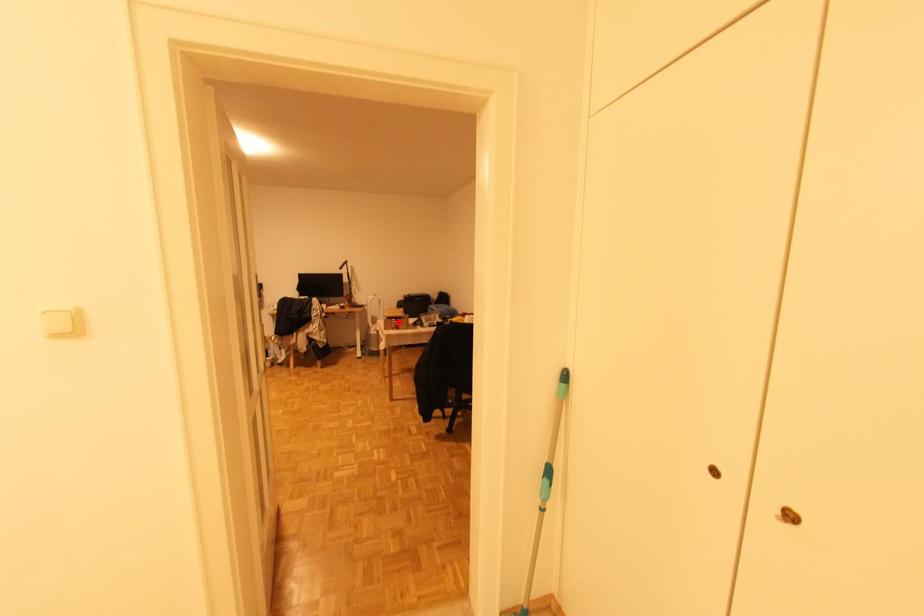
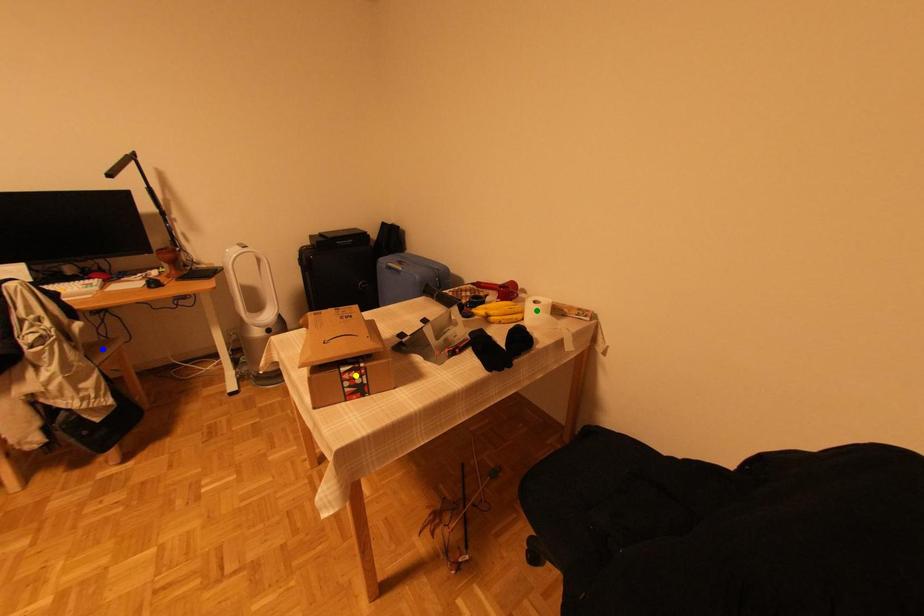
Question: I am providing you with two images of the same scene from different viewpoints. A red point is marked on the first image. You are given multiple points on the second image. Which point in image 2 represents the same 3d spot as the red point in image 1?

Choices:
 (A) green point
 (B) yellow point
 (C) blue point

Answer: (B)